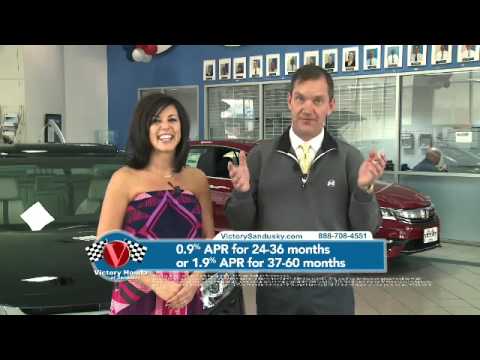
Identify the location of window. This screenshot has height=360, width=480. (433, 126).